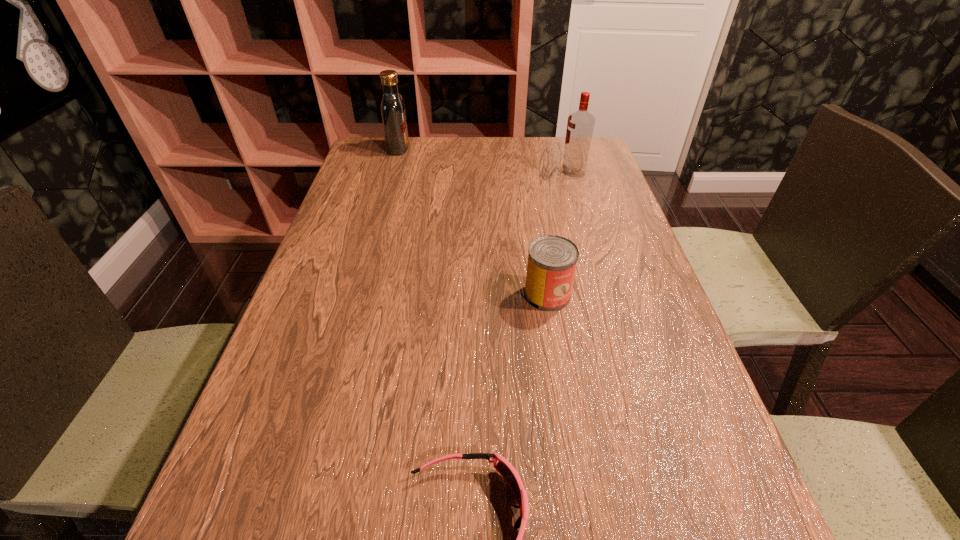
Where is `the leftmost object`? The width and height of the screenshot is (960, 540). the leftmost object is located at coordinates (392, 107).

The width and height of the screenshot is (960, 540). I want to click on the farthest object, so click(x=392, y=107).

Identify the location of the rightmost object. The image size is (960, 540). (580, 125).

Where is `the third nearest object`? The height and width of the screenshot is (540, 960). the third nearest object is located at coordinates (580, 125).

You are a GUI agent. You are given a task and a screenshot of the screen. Output one action in this format:
    pyautogui.click(x=<x>, y=<y>)
    Task: Click on the third farthest object
    The width and height of the screenshot is (960, 540).
    Given the screenshot: What is the action you would take?
    pyautogui.click(x=552, y=260)

Locate an element on the screen. can is located at coordinates (552, 260).

I want to click on vacant space located on the front-facing side of the left vodka, so click(x=469, y=148).

Where is `free region located 0.320m on the front label of the right vodka`? This screenshot has height=540, width=960. free region located 0.320m on the front label of the right vodka is located at coordinates (450, 173).

Where is `vacant space located on the front label of the right vodka`? vacant space located on the front label of the right vodka is located at coordinates (444, 173).

Identify the location of vacant space located on the front label of the right vodka. The image size is (960, 540). (457, 173).